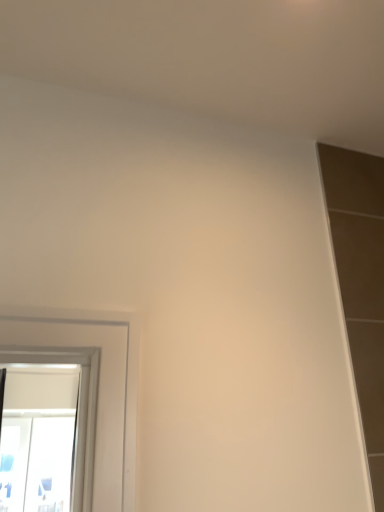
What do you see at coordinates (36, 463) in the screenshot? This screenshot has width=384, height=512. I see `transparent glass screen door at lower left` at bounding box center [36, 463].

In order to face transparent glass screen door at lower left, should I rotate leftwards or rightwards?

Turn left by 18.545 degrees to look at transparent glass screen door at lower left.

Find the location of a particular element. transparent glass screen door at lower left is located at coordinates (36, 463).

I want to click on transparent glass screen door at lower left, so click(36, 463).